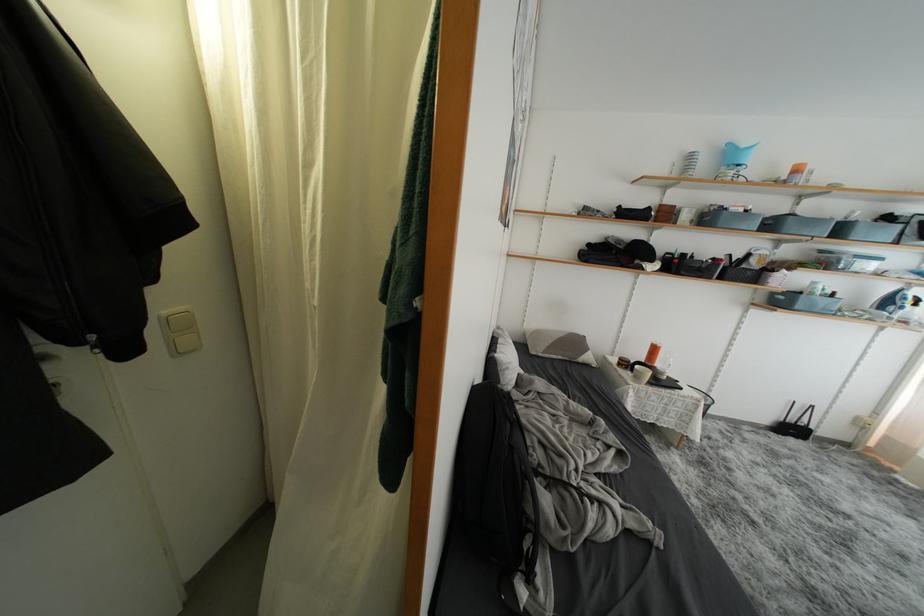
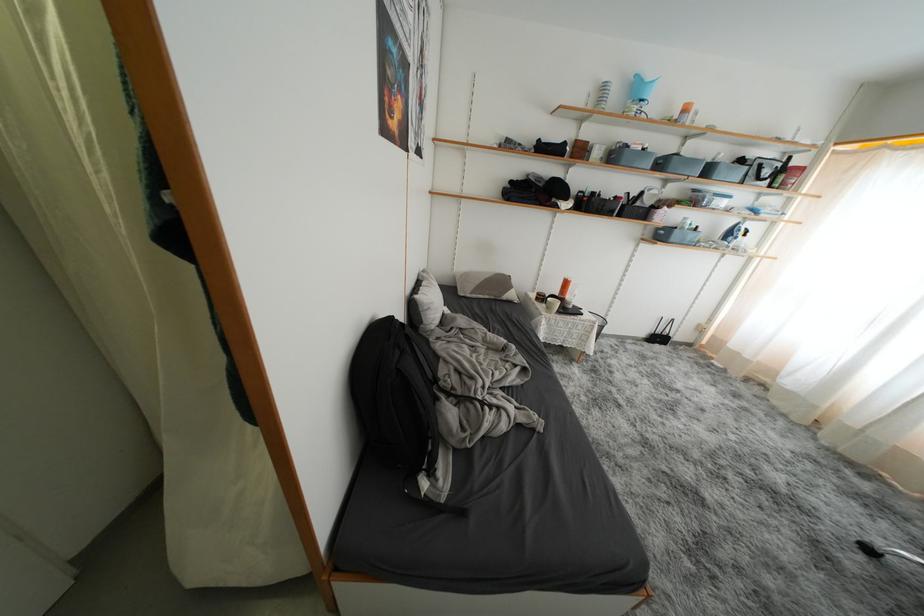
Where in the second image is the point corresponding to point 515,430 from the first image?

(404, 357)